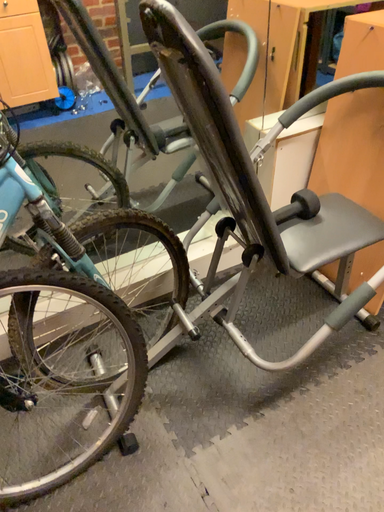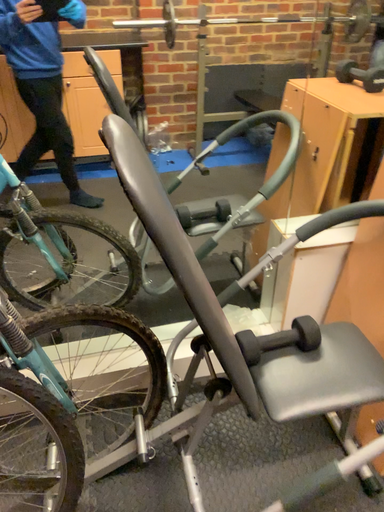
Question: Which way did the camera rotate in the video?

Choices:
 (A) rotated right
 (B) rotated left

Answer: (B)